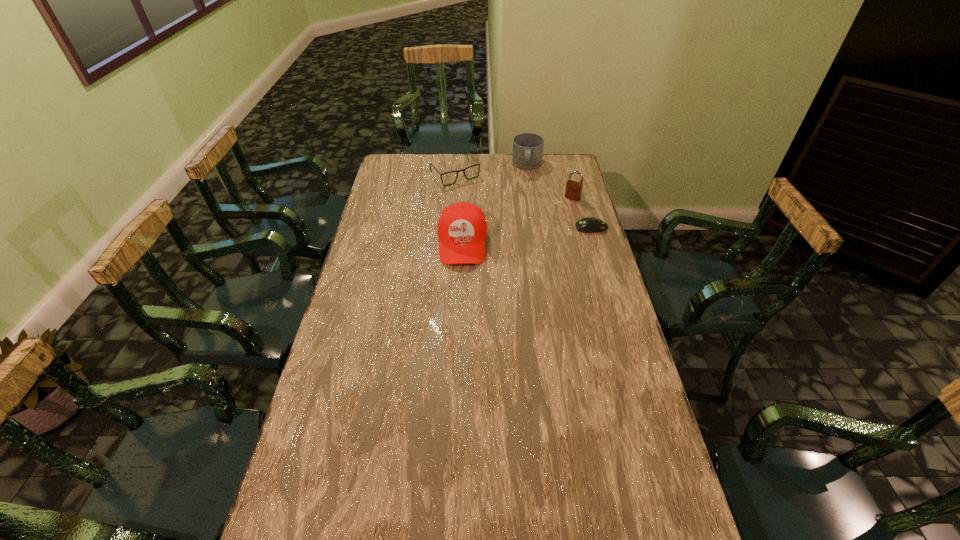
Where is `free space located on the front-facing side of the padlock`? free space located on the front-facing side of the padlock is located at coordinates (543, 234).

Find the location of a particular element. This screenshot has height=540, width=960. vacant space located 0.330m on the front-facing side of the padlock is located at coordinates (537, 243).

The width and height of the screenshot is (960, 540). I want to click on free region located on the side of the third object from left to right with the handle, so (526, 194).

The image size is (960, 540). What are the coordinates of `vacant space located on the side of the third object from left to right with the handle` in the screenshot? It's located at (525, 204).

Locate an element on the screen. vacant region located on the side of the third object from left to right with the handle is located at coordinates (525, 206).

Find the location of a particular element. The image size is (960, 540). spectacles that is at the far edge is located at coordinates (430, 163).

Where is `mug present at the far edge`? The image size is (960, 540). mug present at the far edge is located at coordinates (527, 153).

Locate an element on the screen. The image size is (960, 540). computer mouse that is at the right edge is located at coordinates (586, 225).

Locate an element on the screen. Image resolution: width=960 pixels, height=540 pixels. padlock located at the right edge is located at coordinates [x=573, y=191].

The height and width of the screenshot is (540, 960). Find the location of `mug that is at the right edge`. mug that is at the right edge is located at coordinates (527, 153).